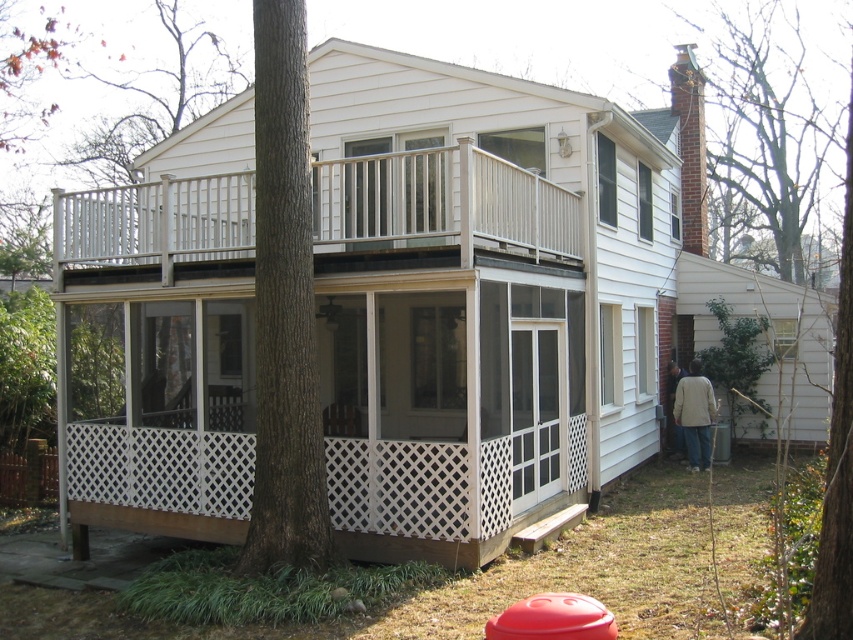
Question: Which object is closer to the camera taking this photo?

Choices:
 (A) light brown jacket at lower right
 (B) white wood porch at upper center
 (C) light beige jacket at lower right

Answer: (B)

Question: Which of the following is the farthest from the observer?

Choices:
 (A) pos(242,195)
 (B) pos(694,404)
 (C) pos(682,372)

Answer: (C)

Question: Does white wood porch at upper center appear on the right side of light beige jacket at lower right?

Choices:
 (A) yes
 (B) no

Answer: (B)

Question: In this image, where is light beige jacket at lower right located relative to light brown jacket at lower right?

Choices:
 (A) left
 (B) right

Answer: (B)

Question: Which object appears closest to the camera in this image?

Choices:
 (A) light beige jacket at lower right
 (B) white wood porch at upper center

Answer: (B)

Question: Can you confirm if white wood porch at upper center is wider than light brown jacket at lower right?

Choices:
 (A) no
 (B) yes

Answer: (B)